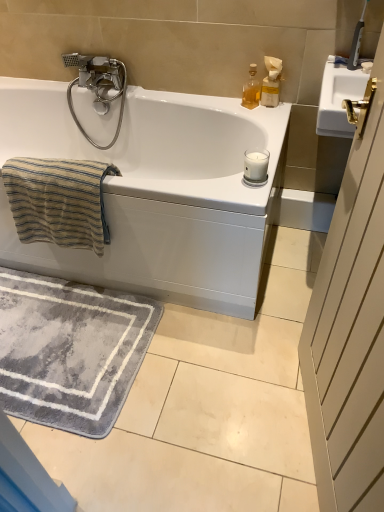
The width and height of the screenshot is (384, 512). I want to click on beige striped towel at left, so click(x=59, y=201).

What is the approximate width of white frosted glass candle at upper right?

It is 3.83 inches.

In order to face white frosted glass candle at upper right, should I rotate leftwards or rightwards?

Rotate your view right by about 8.757°.

Identify the location of white wood screen door at right. (350, 328).

This screenshot has height=512, width=384. Find the location of `beige striped towel at left`. beige striped towel at left is located at coordinates (59, 201).

Considering the sizes of objects beige striped towel at left and white glossy bathtub at upper center in the image provided, who is shorter, beige striped towel at left or white glossy bathtub at upper center?

Standing shorter between the two is beige striped towel at left.

Is white glossy bathtub at upper center surrounded by beige striped towel at left?

That's incorrect, white glossy bathtub at upper center is not inside beige striped towel at left.

Is beige striped towel at left oriented towards white glossy bathtub at upper center?

Yes, beige striped towel at left is turned towards white glossy bathtub at upper center.

Which of these two, white wood screen door at right or beige striped towel at left, is smaller?

beige striped towel at left is smaller.

Between white wood screen door at right and beige striped towel at left, which one is positioned in front?

white wood screen door at right is more forward.

Is white wood screen door at right taller or shorter than beige striped towel at left?

In the image, white wood screen door at right appears to be taller than beige striped towel at left.

Between white glossy bathtub at upper center and beige striped towel at left, which one has less height?

Standing shorter between the two is beige striped towel at left.

Is white glossy bathtub at upper center in front of or behind beige striped towel at left in the image?

white glossy bathtub at upper center is positioned closer to the viewer than beige striped towel at left.

From a real-world perspective, between white glossy bathtub at upper center and beige striped towel at left, who is vertically lower?

white glossy bathtub at upper center, from a real-world perspective.

Does point (158, 248) come farther from viewer compared to point (85, 195)?

Yes, point (158, 248) is behind point (85, 195).

Which object is positioned more to the right, beige striped towel at left or white wood screen door at right?

Positioned to the right is white wood screen door at right.

Is white wood screen door at right at the back of beige striped towel at left?

beige striped towel at left does not have its back to white wood screen door at right.

Which object is thinner, beige striped towel at left or white wood screen door at right?

With smaller width is white wood screen door at right.

Which of these two, beige striped towel at left or white wood screen door at right, stands shorter?

With less height is beige striped towel at left.

In the scene shown: Between white glossy bathtub at upper center and silver metallic faucet at upper left, which one is positioned in front?

Positioned in front is white glossy bathtub at upper center.

Is white glossy bathtub at upper center completely or partially outside of silver metallic faucet at upper left?

Indeed, white glossy bathtub at upper center is completely outside silver metallic faucet at upper left.

Between white glossy bathtub at upper center and silver metallic faucet at upper left, which one appears on the left side from the viewer's perspective?

white glossy bathtub at upper center is more to the left.

Are white glossy bathtub at upper center and silver metallic faucet at upper left beside each other?

No, white glossy bathtub at upper center is not next to silver metallic faucet at upper left.

Which of these two, white frosted glass candle at upper right or silver metallic faucet at upper left, stands shorter?

Standing shorter between the two is white frosted glass candle at upper right.

The width and height of the screenshot is (384, 512). In the image, there is a white frosted glass candle at upper right. Identify the location of tap above it (from the image's perspective). (98, 86).

Which is further, (248,160) or (91,59)?

Positioned behind is point (91,59).

Considering the sizes of objects white plastic soap dispenser at upper right, the second soap dispenser when ordered from left to right, and white frosted glass candle at upper right in the image provided, who is smaller, white plastic soap dispenser at upper right, the second soap dispenser when ordered from left to right, or white frosted glass candle at upper right?

white frosted glass candle at upper right is smaller.

From a real-world perspective, who is located higher, white plastic soap dispenser at upper right, the second soap dispenser when ordered from left to right, or white frosted glass candle at upper right?

white plastic soap dispenser at upper right, the second soap dispenser when ordered from left to right.

Could you tell me if white plastic soap dispenser at upper right, the second soap dispenser when ordered from left to right, is turned towards white frosted glass candle at upper right?

Yes, white plastic soap dispenser at upper right, the second soap dispenser when ordered from left to right, is aimed at white frosted glass candle at upper right.

Based on their positions, is white plastic soap dispenser at upper right, the second soap dispenser when ordered from left to right, located to the left or right of white frosted glass candle at upper right?

In the image, white plastic soap dispenser at upper right, the second soap dispenser when ordered from left to right, appears on the right side of white frosted glass candle at upper right.

Image resolution: width=384 pixels, height=512 pixels. I want to click on beach towel above the white glossy bathtub at upper center (from a real-world perspective), so click(59, 201).

I want to click on screen door in front of the beige striped towel at left, so click(x=350, y=328).

Estimate the real-world distances between objects in this image. Which object is further from translucent glass bottle at upper right, arranged as the 1th soap dispenser when viewed from the left, white wood screen door at right or beige striped towel at left?

white wood screen door at right is positioned further to the anchor translucent glass bottle at upper right, arranged as the 1th soap dispenser when viewed from the left.

Estimate the real-world distances between objects in this image. Which object is closer to white frosted glass candle at upper right, white plastic soap dispenser at upper right, the second soap dispenser when ordered from left to right, or gray plush bath mat at lower left?

The object closer to white frosted glass candle at upper right is white plastic soap dispenser at upper right, the second soap dispenser when ordered from left to right.

Estimate the real-world distances between objects in this image. Which object is closer to white glossy bathtub at upper center, white frosted glass candle at upper right or white plastic soap dispenser at upper right, the 1th soap dispenser positioned from the right?

white plastic soap dispenser at upper right, the 1th soap dispenser positioned from the right.

Considering their positions, is beige striped towel at left positioned further to silver metallic faucet at upper left than white frosted glass candle at upper right?

Based on the image, white frosted glass candle at upper right appears to be further to silver metallic faucet at upper left.

Looking at the image, which one is located further to white frosted glass candle at upper right, gray plush bath mat at lower left or beige striped towel at left?

gray plush bath mat at lower left.

Estimate the real-world distances between objects in this image. Which object is further from silver metallic faucet at upper left, translucent glass bottle at upper right, which appears as the 2th soap dispenser when viewed from the right, or white frosted glass candle at upper right?

The object further to silver metallic faucet at upper left is white frosted glass candle at upper right.

Looking at the image, which one is located further to gray plush bath mat at lower left, white plastic soap dispenser at upper right, the 1th soap dispenser positioned from the right, or silver metallic faucet at upper left?

Among the two, white plastic soap dispenser at upper right, the 1th soap dispenser positioned from the right, is located further to gray plush bath mat at lower left.

Estimate the real-world distances between objects in this image. Which object is closer to gray plush bath mat at lower left, white wood screen door at right or beige striped towel at left?

beige striped towel at left lies closer to gray plush bath mat at lower left than the other object.

Identify the location of candle between white plastic soap dispenser at upper right, the second soap dispenser when ordered from left to right, and gray plush bath mat at lower left from top to bottom. The width and height of the screenshot is (384, 512). (256, 165).

Locate an element on the screen. The width and height of the screenshot is (384, 512). candle between beige striped towel at left and white plastic soap dispenser at upper right, the 1th soap dispenser positioned from the right is located at coordinates (256, 165).

This screenshot has width=384, height=512. I want to click on tap between white plastic soap dispenser at upper right, the second soap dispenser when ordered from left to right, and gray plush bath mat at lower left from top to bottom, so click(x=98, y=86).

At what (x,y) coordinates should I click in order to perform the action: click on tap between white glossy bathtub at upper center and translucent glass bottle at upper right, arranged as the 1th soap dispenser when viewed from the left. Please return your answer as a coordinate pair (x, y). Image resolution: width=384 pixels, height=512 pixels. Looking at the image, I should click on (98, 86).